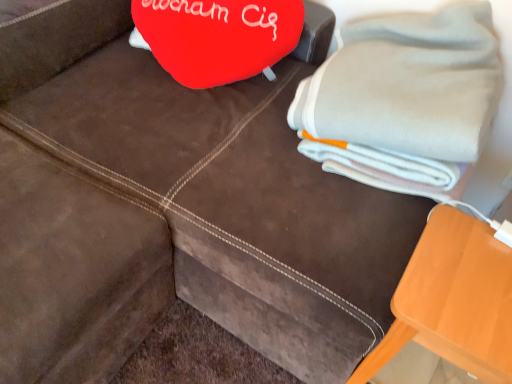
This screenshot has height=384, width=512. I want to click on vacant region above orange wood table at lower right (from a real-world perspective), so click(471, 276).